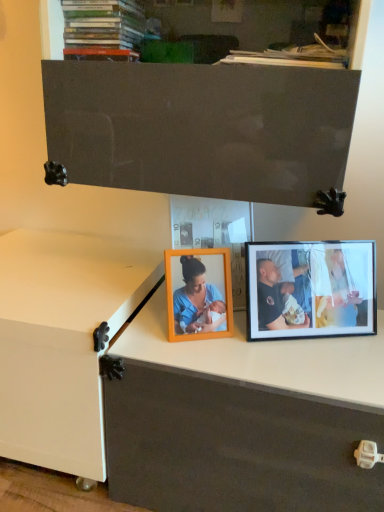
Question: Could you tell me if white glossy changing table at lower left is turned towards black matte photo frame at right?

Choices:
 (A) no
 (B) yes

Answer: (A)

Question: Can we say white glossy changing table at lower left lies outside black matte photo frame at right?

Choices:
 (A) no
 (B) yes

Answer: (B)

Question: Is white glossy changing table at lower left to the right of black matte photo frame at right from the viewer's perspective?

Choices:
 (A) yes
 (B) no

Answer: (B)

Question: Is white glossy changing table at lower left thinner than black matte photo frame at right?

Choices:
 (A) yes
 (B) no

Answer: (B)

Question: Is white glossy changing table at lower left positioned with its back to black matte photo frame at right?

Choices:
 (A) no
 (B) yes

Answer: (A)

Question: Would you say black matte photo frame at right is part of white glossy changing table at lower left's contents?

Choices:
 (A) no
 (B) yes

Answer: (A)

Question: From a real-world perspective, is black matte photo frame at right on top of white glossy changing table at lower left?

Choices:
 (A) yes
 (B) no

Answer: (A)

Question: Is black matte photo frame at right shorter than white glossy changing table at lower left?

Choices:
 (A) yes
 (B) no

Answer: (A)

Question: Is black matte photo frame at right aimed at white glossy changing table at lower left?

Choices:
 (A) yes
 (B) no

Answer: (B)

Question: Considering the relative sizes of black matte photo frame at right and white glossy changing table at lower left in the image provided, is black matte photo frame at right bigger than white glossy changing table at lower left?

Choices:
 (A) yes
 (B) no

Answer: (B)

Question: Is the depth of black matte photo frame at right less than that of white glossy changing table at lower left?

Choices:
 (A) no
 (B) yes

Answer: (A)

Question: Would you say black matte photo frame at right is a long distance from white glossy changing table at lower left?

Choices:
 (A) no
 (B) yes

Answer: (A)

Question: In the image, is black matte photo frame at right positioned in front of or behind white glossy changing table at lower left?

Choices:
 (A) front
 (B) behind

Answer: (B)